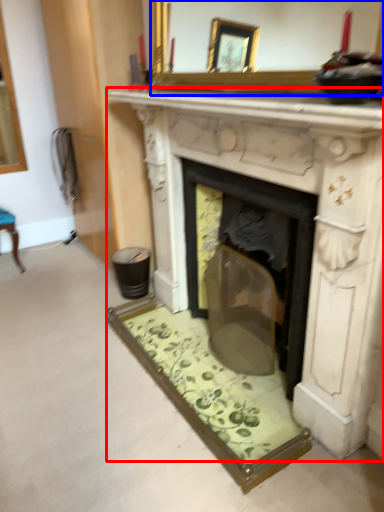
Question: Which point is closer to the camera, fireplace (highlighted by a red box) or mirror (highlighted by a blue box)?

Choices:
 (A) fireplace
 (B) mirror

Answer: (B)